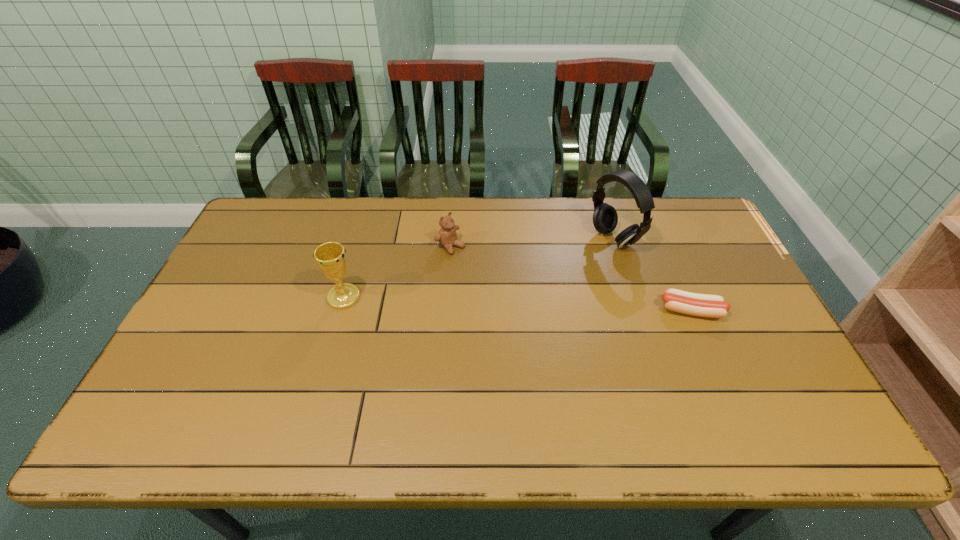
Identify the location of free spot between the sausage and the chalice. Image resolution: width=960 pixels, height=540 pixels. (517, 304).

Find the location of a particular element. This screenshot has width=960, height=540. vacant space that's between the earphone and the chalice is located at coordinates (478, 268).

Locate which object ranks second in proximity to the shortest object. Please provide its 2D coordinates. Your answer should be formatted as a tuple, i.e. [(x, y)], where the tuple contains the x and y coordinates of a point satisfying the conditions above.

[(447, 236)]

Identify which object is located as the nearest to the shortest object. Please provide its 2D coordinates. Your answer should be formatted as a tuple, i.e. [(x, y)], where the tuple contains the x and y coordinates of a point satisfying the conditions above.

[(605, 218)]

The image size is (960, 540). Identify the location of free space that satisfies the following two spatial constraints: 1. on the back side of the leftmost object; 2. on the right side of the tallest object. (360, 239).

At what (x,y) coordinates should I click in order to perform the action: click on vacant area that satisfies the following two spatial constraints: 1. on the back side of the third object from right to left; 2. on the left side of the tallest object. Please return your answer as a coordinate pair (x, y). Image resolution: width=960 pixels, height=540 pixels. Looking at the image, I should click on (451, 239).